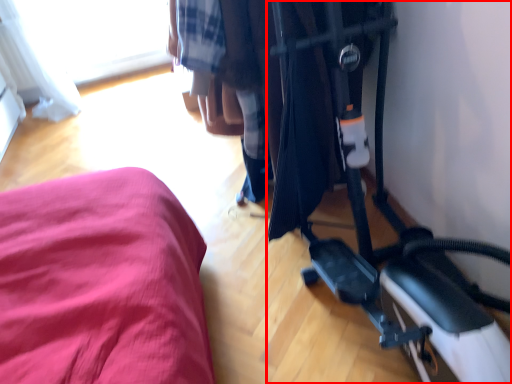
Question: Observing the image, what is the correct spatial positioning of baby carriage (annotated by the red box) in reference to window?

Choices:
 (A) right
 (B) left

Answer: (A)